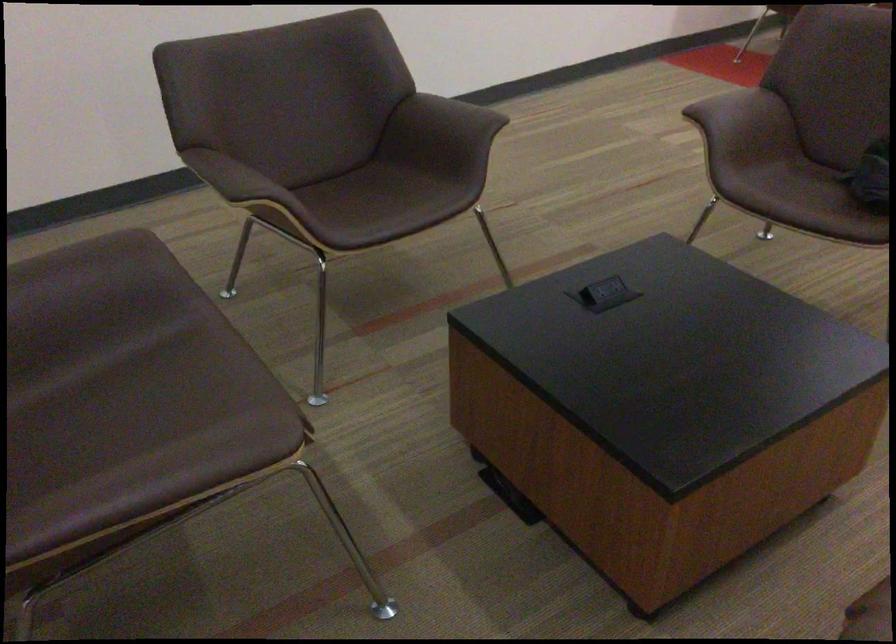
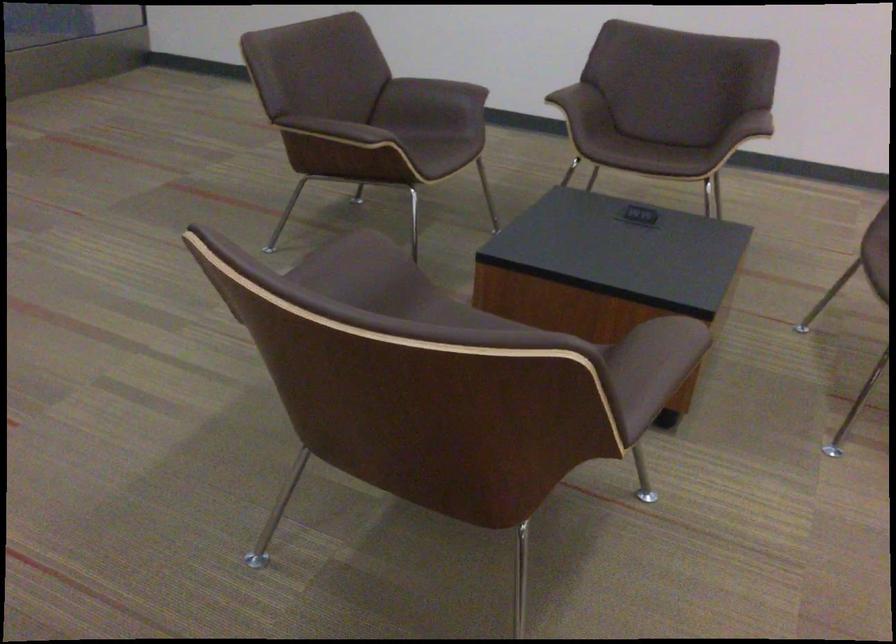
Locate, in the second image, the point that corresponds to the point at 70,287 in the first image.

(435, 90)